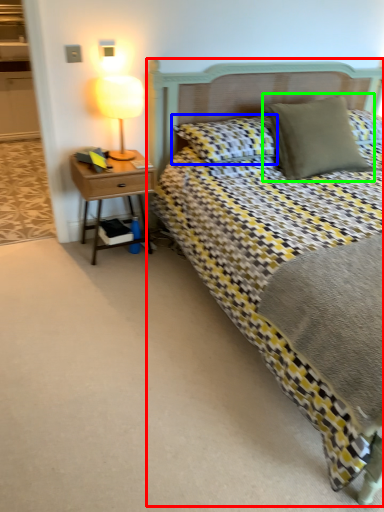
Question: Which object is positioned closest to bed (highlighted by a red box)? Select from pillow (highlighted by a blue box) and pillow (highlighted by a green box).

Choices:
 (A) pillow
 (B) pillow

Answer: (A)